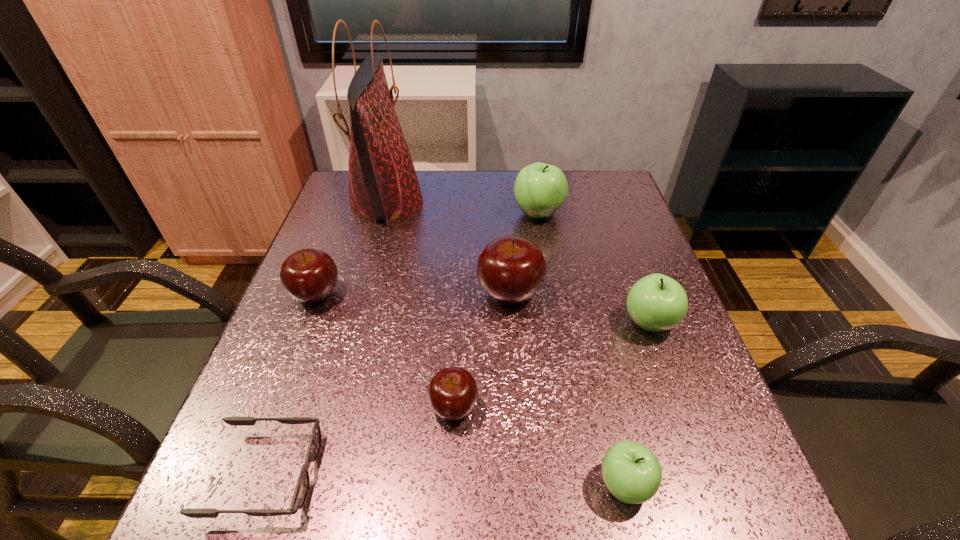
I want to click on object that is at the near right corner, so click(x=632, y=473).

Where is `free space at the far edge of the desktop`? free space at the far edge of the desktop is located at coordinates (442, 184).

At what (x,y) coordinates should I click in order to perform the action: click on vacant region at the near edge. Please return your answer as a coordinate pair (x, y). Image resolution: width=960 pixels, height=540 pixels. Looking at the image, I should click on (499, 482).

At what (x,y) coordinates should I click in order to perform the action: click on free space at the left edge. Please return your answer as a coordinate pair (x, y). This screenshot has height=540, width=960. Looking at the image, I should click on (282, 348).

Locate an element on the screen. The image size is (960, 540). free space at the right edge of the desktop is located at coordinates (690, 429).

I want to click on free space at the far right corner, so click(617, 186).

The image size is (960, 540). I want to click on unoccupied position between the smallest red apple and the sunglasses, so click(360, 441).

Find the location of a particular element. free space between the sunglasses and the second nearest apple is located at coordinates (360, 441).

The height and width of the screenshot is (540, 960). I want to click on blank region between the nearest green apple and the second farthest green apple, so click(x=636, y=403).

Locate an element on the screen. blank region between the shortest object and the second biggest red apple is located at coordinates (291, 384).